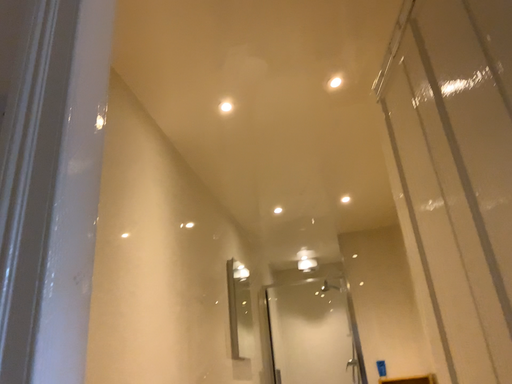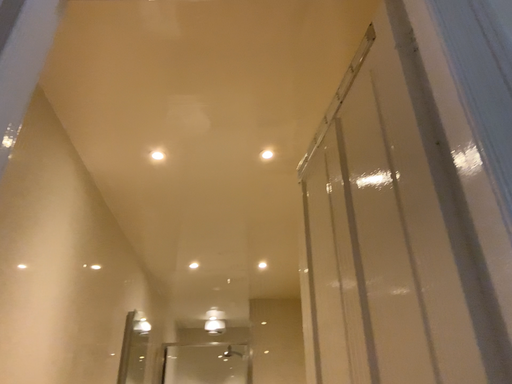
Question: How did the camera likely rotate when shooting the video?

Choices:
 (A) rotated right
 (B) rotated left

Answer: (A)